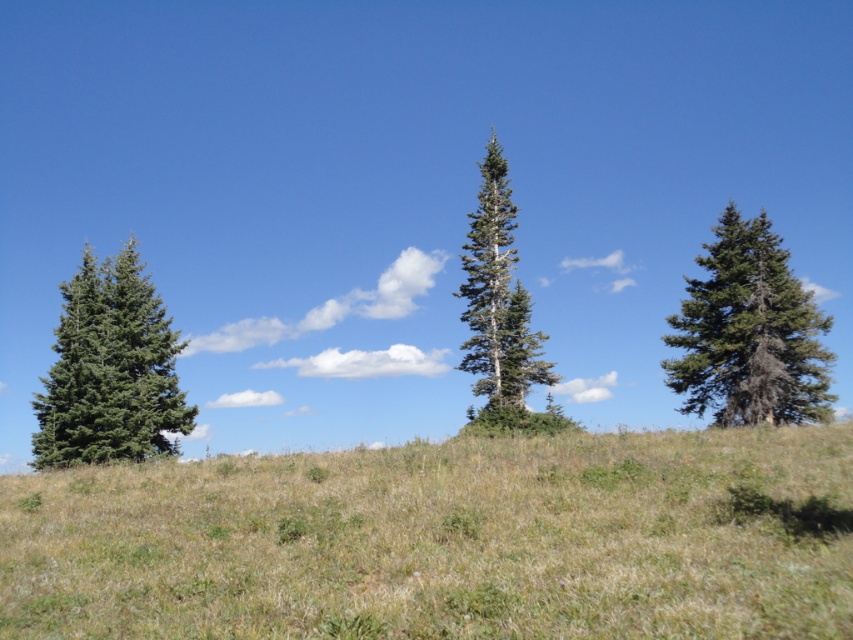
Question: Can you confirm if green matte tree at right is positioned above green matte tree at left?

Choices:
 (A) yes
 (B) no

Answer: (A)

Question: Does green matte tree at left appear on the right side of green matte tree at center?

Choices:
 (A) yes
 (B) no

Answer: (B)

Question: Which of the following is the farthest from the observer?

Choices:
 (A) green grassy hillside at center
 (B) green matte tree at center

Answer: (B)

Question: Which of these objects is positioned farthest from the green matte tree at right?

Choices:
 (A) green matte tree at left
 (B) green grassy hillside at center

Answer: (A)

Question: Does green grassy hillside at center have a lesser width compared to green matte tree at center?

Choices:
 (A) yes
 (B) no

Answer: (B)

Question: Based on their relative distances, which object is nearer to the green matte tree at right?

Choices:
 (A) green matte tree at center
 (B) green matte tree at left

Answer: (A)